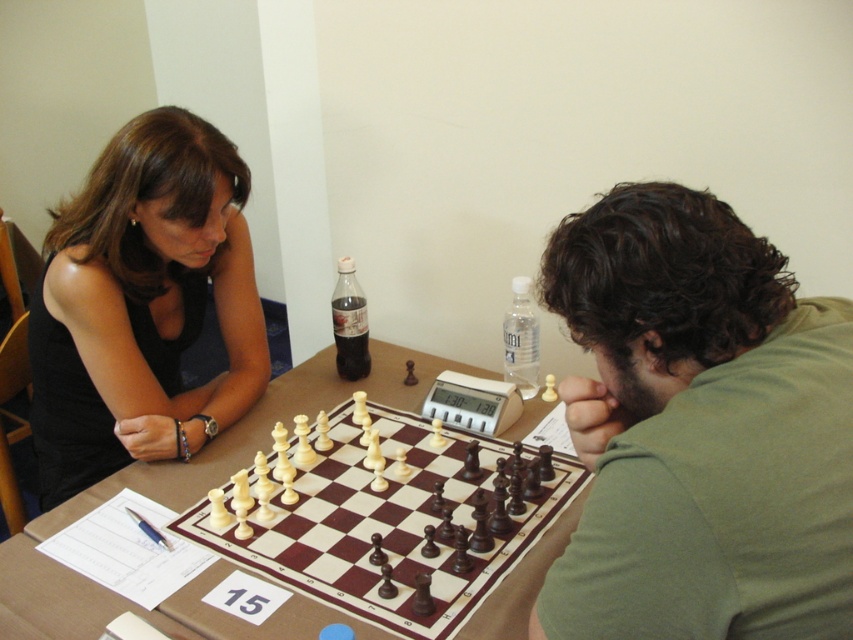
Which is below, dark glass bottle at center or transparent plastic water bottle at center?

transparent plastic water bottle at center is lower down.

In order to click on dark glass bottle at center in this screenshot , I will do `click(349, 323)`.

Is green matte shirt at center above transparent plastic water bottle at center?

No.

Between point (646, 211) and point (506, 337), which one is positioned behind?

Point (506, 337)

The height and width of the screenshot is (640, 853). I want to click on green matte shirt at center, so click(x=699, y=428).

Is green matte shirt at center taller than dark glass bottle at center?

Indeed, green matte shirt at center has a greater height compared to dark glass bottle at center.

Which is more to the left, green matte shirt at center or dark glass bottle at center?

dark glass bottle at center

Find the location of a particular element. Image resolution: width=853 pixels, height=640 pixels. green matte shirt at center is located at coordinates (699, 428).